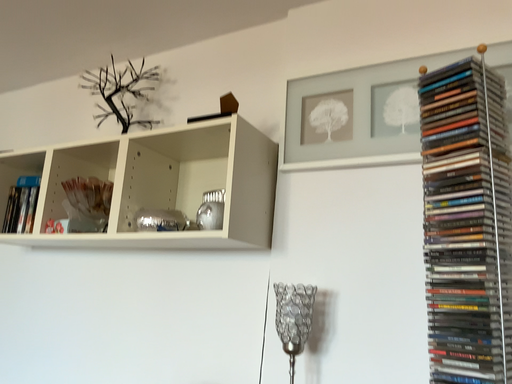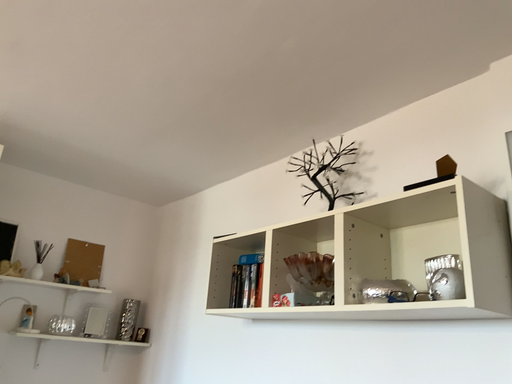
Question: How did the camera likely rotate when shooting the video?

Choices:
 (A) rotated left
 (B) rotated right

Answer: (A)